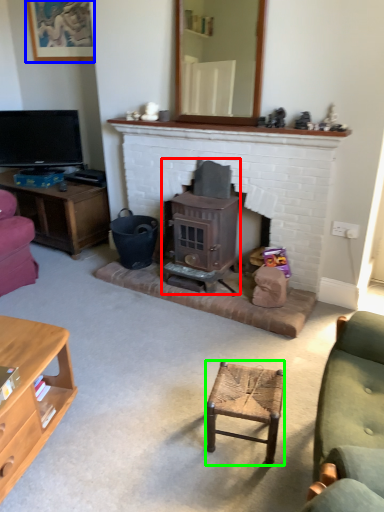
Question: Based on their relative distances, which object is farther from wood burning stove (highlighted by a red box)? Choose from picture frame (highlighted by a blue box) and stool (highlighted by a green box).

Choices:
 (A) picture frame
 (B) stool

Answer: (A)